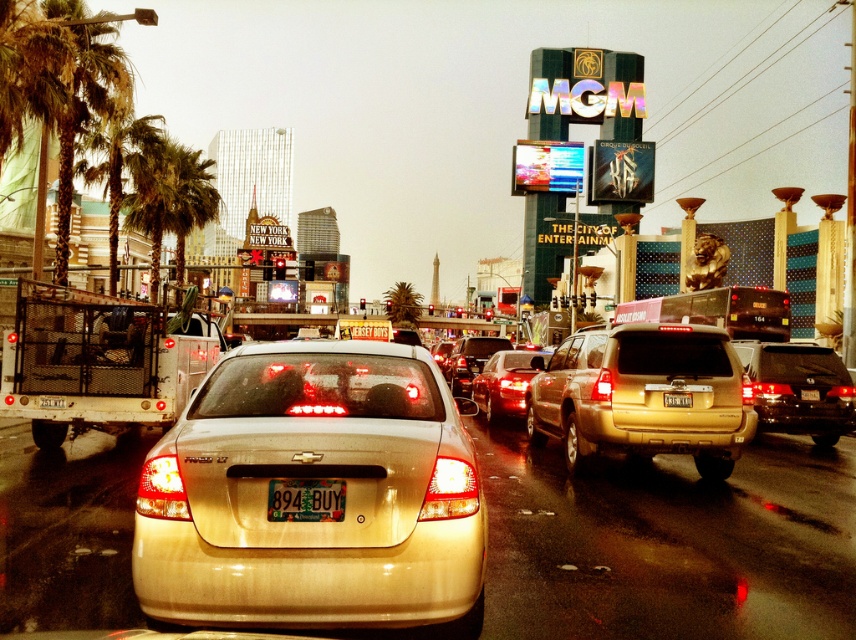
Question: Is gold metallic suv at center above shiny gold suv at right?

Choices:
 (A) no
 (B) yes

Answer: (B)

Question: Can you confirm if shiny gold suv at right is wider than green leafy palm tree at left?

Choices:
 (A) yes
 (B) no

Answer: (B)

Question: Which point is closer to the camera taking this photo?

Choices:
 (A) (87, 163)
 (B) (334, 481)
 (C) (494, 342)
 (D) (762, 381)

Answer: (B)

Question: Which point is farther to the camera?

Choices:
 (A) white plastic license plate at center
 (B) green plastic license plate at center
 (C) gold metallic suv at center
 (D) shiny gold suv at center

Answer: (D)

Question: Which object is farther from the camera taking this photo?

Choices:
 (A) shiny gold suv at center
 (B) gold metallic sedan at center
 (C) green leafy palm tree at left
 (D) white plastic license plate at center

Answer: (C)

Question: Where is metallic gold sedan at center located in relation to green leafy palm tree at left in the image?

Choices:
 (A) above
 (B) below

Answer: (B)